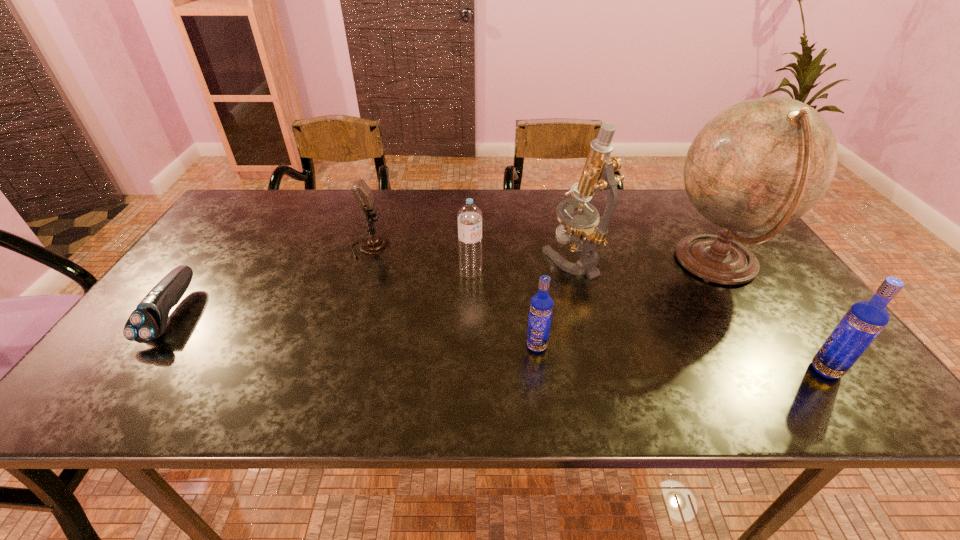
At what (x,y) coordinates should I click in order to perform the action: click on free space located 0.390m on the right of the farther vodka. Please return your answer as a coordinate pair (x, y). The image size is (960, 540). Looking at the image, I should click on (722, 346).

I want to click on blank space located 0.340m on the back of the nearest object, so click(747, 261).

Find the location of a particular element. The height and width of the screenshot is (540, 960). blank space located on the front-facing side of the microphone is located at coordinates (442, 247).

Where is `vacant point located on the left of the microscope`? vacant point located on the left of the microscope is located at coordinates (450, 259).

Find the location of `free space located on the front-facing side of the globe`. free space located on the front-facing side of the globe is located at coordinates (570, 264).

In order to click on free spot located on the front-facing side of the globe in this screenshot , I will do `click(632, 264)`.

The width and height of the screenshot is (960, 540). I want to click on blank space located 0.300m on the front-facing side of the globe, so click(x=552, y=264).

This screenshot has height=540, width=960. Find the location of `vacant space located 0.270m on the right of the third object from left to right`. vacant space located 0.270m on the right of the third object from left to right is located at coordinates (584, 273).

The width and height of the screenshot is (960, 540). Identify the location of object that is at the far edge. (760, 164).

Find the location of a particular element. This screenshot has height=540, width=960. electric shaver present at the near edge is located at coordinates (148, 321).